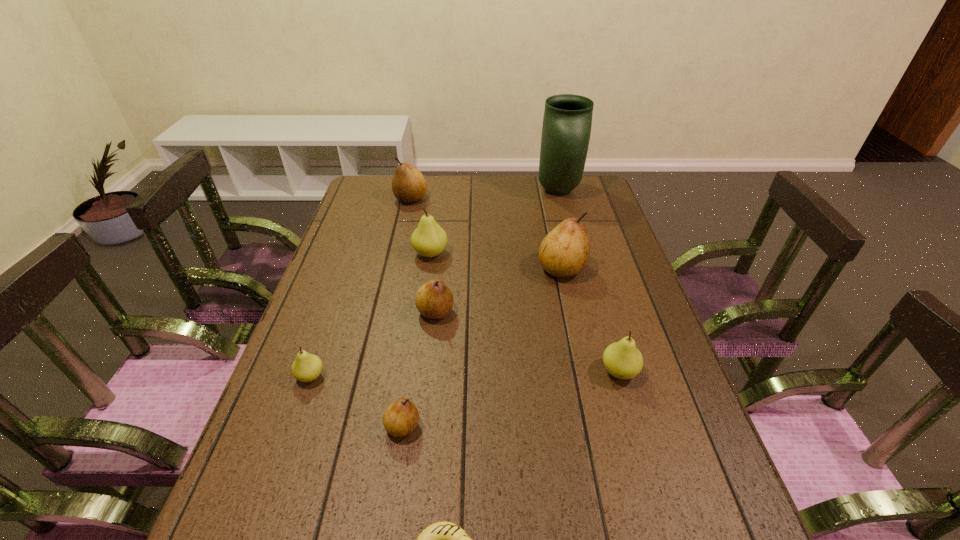
Identify the location of the rightmost green pear. This screenshot has height=540, width=960. pyautogui.click(x=622, y=359).

This screenshot has width=960, height=540. I want to click on the leftmost object, so click(x=307, y=367).

Locate an element on the screen. This screenshot has height=540, width=960. the smallest green pear is located at coordinates (307, 367).

Find the location of a particular element. the second nearest object is located at coordinates (401, 417).

Locate an element on the screen. The image size is (960, 540). the smallest brown pear is located at coordinates (401, 417).

The width and height of the screenshot is (960, 540). In order to click on free region located 0.200m on the left of the vase in this screenshot , I will do `click(484, 191)`.

I want to click on free spot located on the front of the biggest brown pear, so click(591, 404).

This screenshot has height=540, width=960. Identify the location of vacant position located on the front of the farthest brown pear. (393, 278).

Locate an element on the screen. blank area located on the front of the farthest green pear is located at coordinates tap(419, 341).

Where is `free space located on the back of the third farthest brown pear`? The width and height of the screenshot is (960, 540). free space located on the back of the third farthest brown pear is located at coordinates click(x=442, y=255).